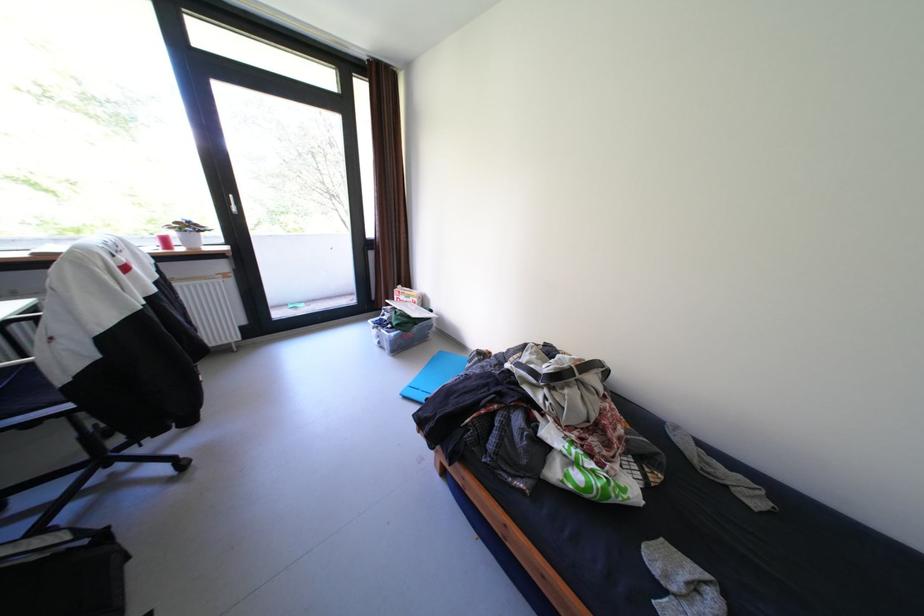
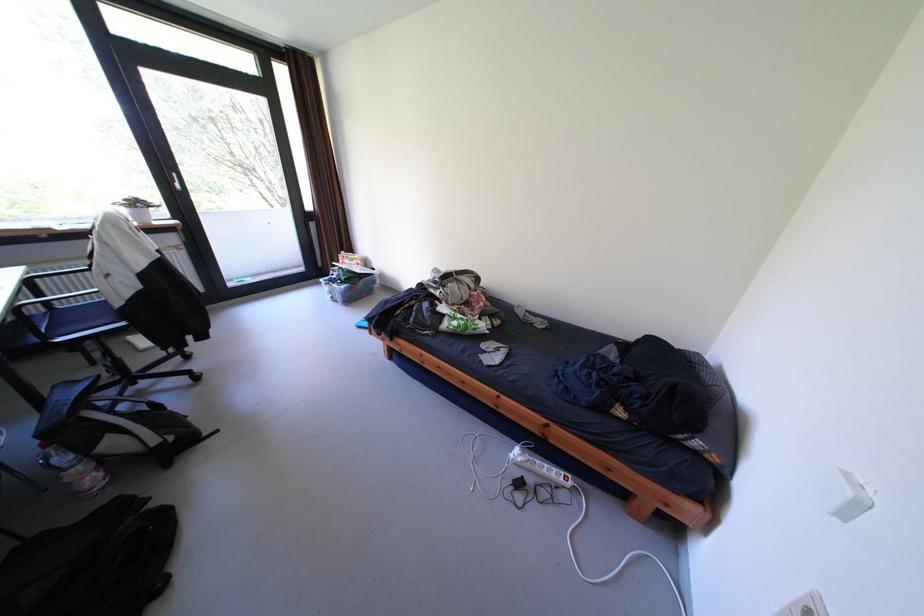
In the second image, find the point that corresponds to point (201, 228) in the first image.

(149, 205)